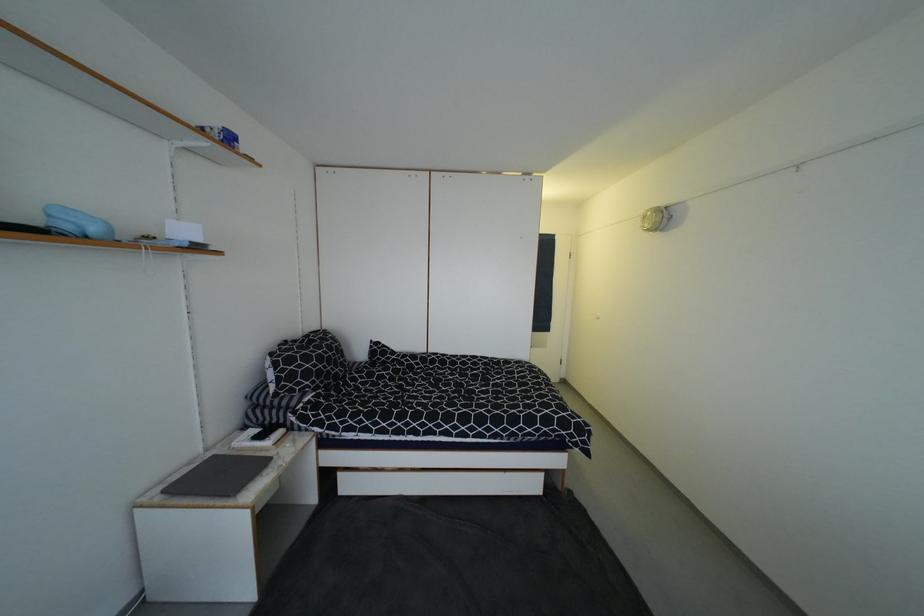
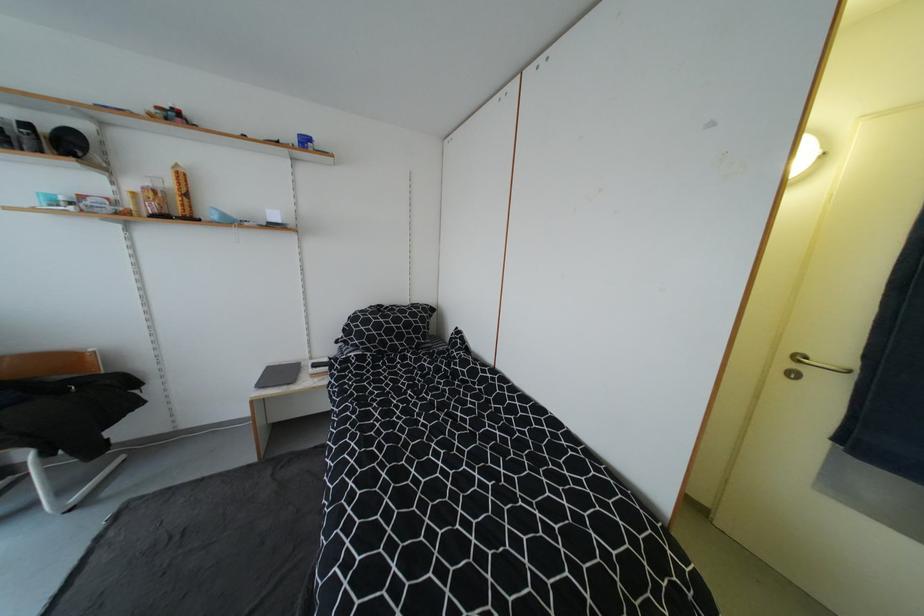
Locate, in the second image, the point that corresponds to (x=305, y=368) in the first image.

(362, 328)